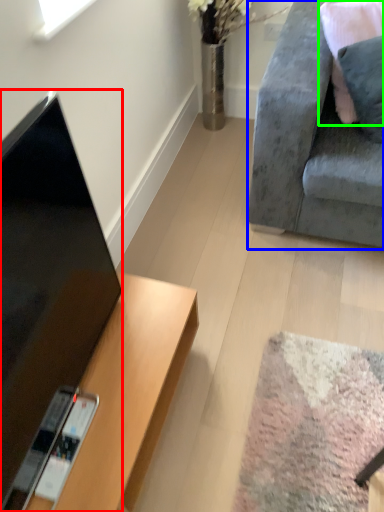
Question: Considering the real-world distances, which object is closest to television (highlighted by a red box)? studio couch (highlighted by a blue box) or pillow (highlighted by a green box).

Choices:
 (A) studio couch
 (B) pillow

Answer: (A)